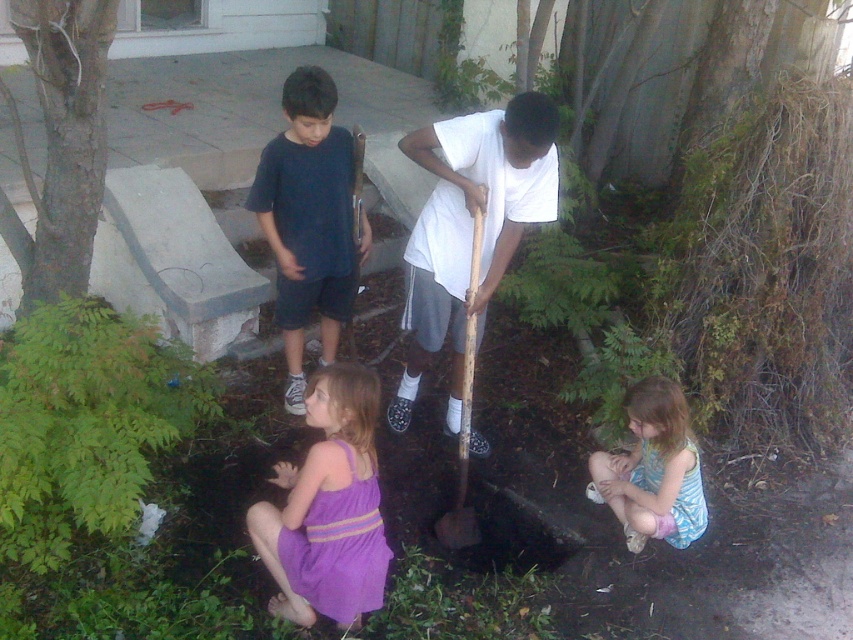
Question: Can you confirm if white wood shovel at center is positioned to the right of light blue striped dress at lower right?

Choices:
 (A) yes
 (B) no

Answer: (B)

Question: Which object appears farthest from the camera in this image?

Choices:
 (A) purple satin dress at lower center
 (B) white wood shovel at center
 (C) smooth bark tree at left

Answer: (B)

Question: Which point is farther from the camera taking this photo?

Choices:
 (A) (334, 472)
 (B) (3, 529)
 (C) (474, 260)

Answer: (C)

Question: Among these objects, which one is farthest from the camera?

Choices:
 (A) green leafy plant at lower left
 (B) purple satin dress at lower center
 (C) dark blue t-shirt at center

Answer: (C)

Question: Is dark blue t-shirt at center positioned behind light blue striped dress at lower right?

Choices:
 (A) no
 (B) yes

Answer: (B)

Question: Can you confirm if light blue striped dress at lower right is positioned below wooden shovel at center?

Choices:
 (A) yes
 (B) no

Answer: (A)